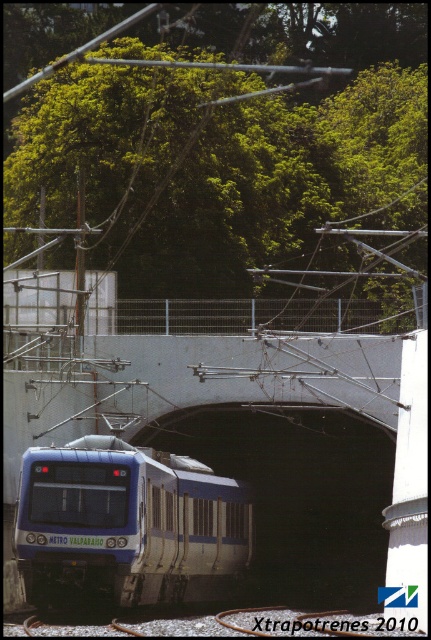
Question: Considering the real-world distances, which object is closest to the black smooth tunnel at center?

Choices:
 (A) blue metallic train at lower left
 (B) green leafy tree at upper center

Answer: (A)

Question: Which point is closer to the camera?

Choices:
 (A) (205, 444)
 (B) (371, 84)
 (C) (21, 541)

Answer: (C)

Question: Can you confirm if green leafy tree at upper center is bigger than blue metallic train at lower left?

Choices:
 (A) no
 (B) yes

Answer: (B)

Question: Is green leafy tree at upper center smaller than black smooth tunnel at center?

Choices:
 (A) yes
 (B) no

Answer: (B)

Question: Is green leafy tree at upper center positioned at the back of black smooth tunnel at center?

Choices:
 (A) yes
 (B) no

Answer: (B)

Question: Considering the real-world distances, which object is farthest from the green leafy tree at upper center?

Choices:
 (A) black smooth tunnel at center
 (B) blue metallic train at lower left

Answer: (B)